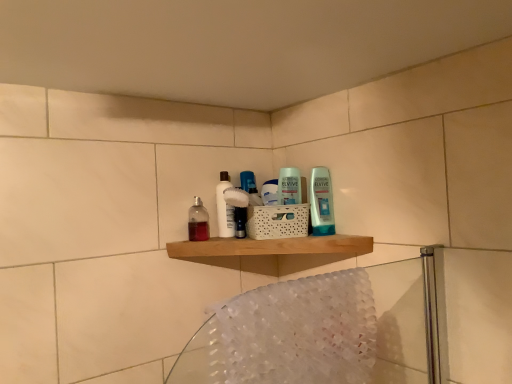
Where is `free space in front of white glossy bottle at center`? This screenshot has height=384, width=512. free space in front of white glossy bottle at center is located at coordinates (233, 239).